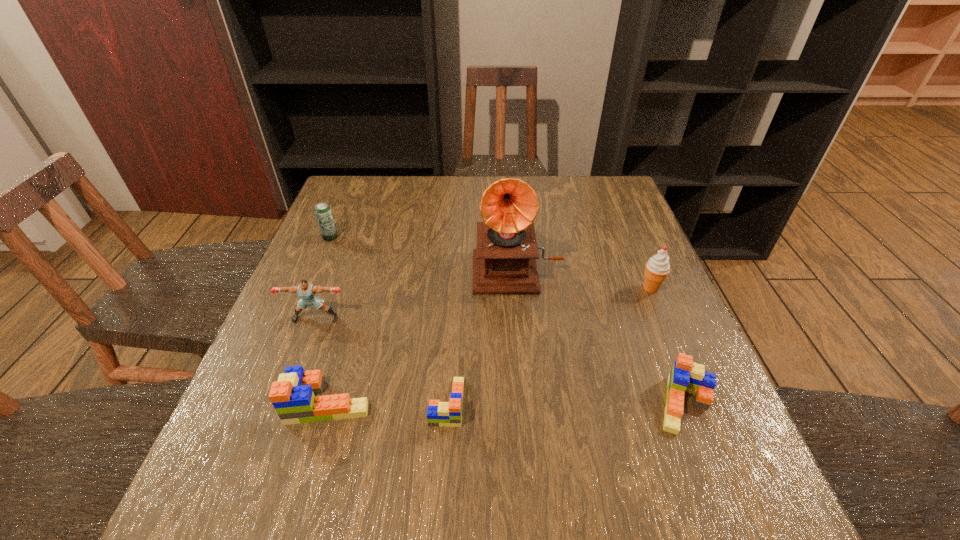
At what (x,y) coordinates should I click in order to perform the action: click on object that is the fifth closest to the leftmost Lego. Please return your answer as a coordinate pair (x, y). The width and height of the screenshot is (960, 540). Looking at the image, I should click on pos(687,376).

Select which Lego appears as the closest to the icecream. Please provide its 2D coordinates. Your answer should be formatted as a tuple, i.e. [(x, y)], where the tuple contains the x and y coordinates of a point satisfying the conditions above.

[(687, 376)]

Identify the location of the second closest Lego to the shortest object. This screenshot has width=960, height=540. (687, 376).

Find the location of a particular element. The height and width of the screenshot is (540, 960). free space that satisfies the following two spatial constraints: 1. on the front-facing side of the puncher; 2. on the right side of the tallest Lego is located at coordinates (284, 402).

Identify the location of free location that satisfies the following two spatial constraints: 1. on the back side of the second shortest Lego; 2. on the right side of the icecream. (639, 288).

You are a GUI agent. You are given a task and a screenshot of the screen. Output one action in this format:
    pyautogui.click(x=<x>, y=<y>)
    Task: Click on the vacant position in the image that satisfies the following two spatial constraints: 1. on the front-facing side of the leftmost Lego; 2. on the right side of the puncher
    This screenshot has width=960, height=540.
    Given the screenshot: What is the action you would take?
    pyautogui.click(x=284, y=402)

This screenshot has height=540, width=960. What are the coordinates of `vacant space that satisfies the following two spatial constraints: 1. on the front-facing side of the leftmost Lego; 2. on the left side of the fourth nearest object` in the screenshot? It's located at (284, 402).

The width and height of the screenshot is (960, 540). Identify the location of free space that satisfies the following two spatial constraints: 1. on the horn of the phonograph record; 2. on the left side of the icecream. (519, 288).